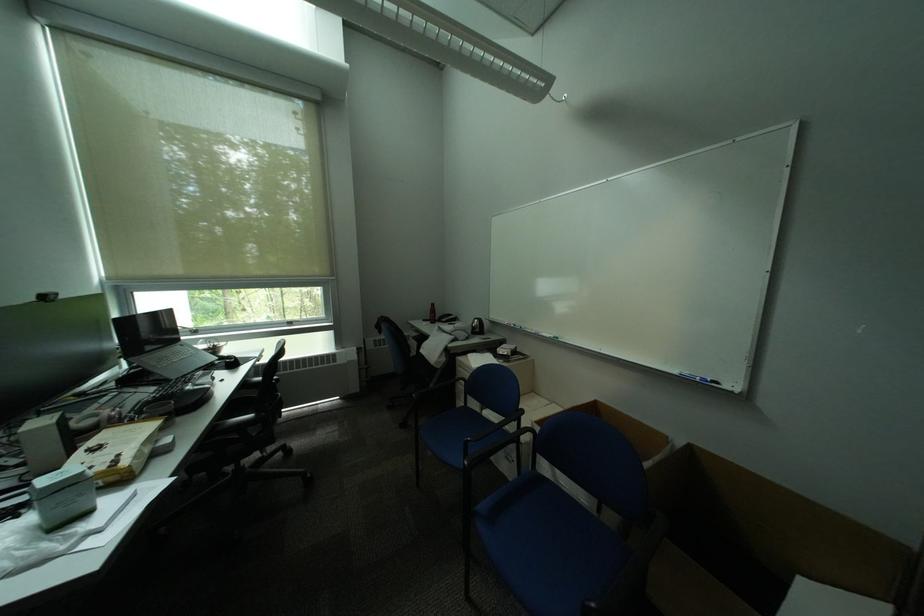
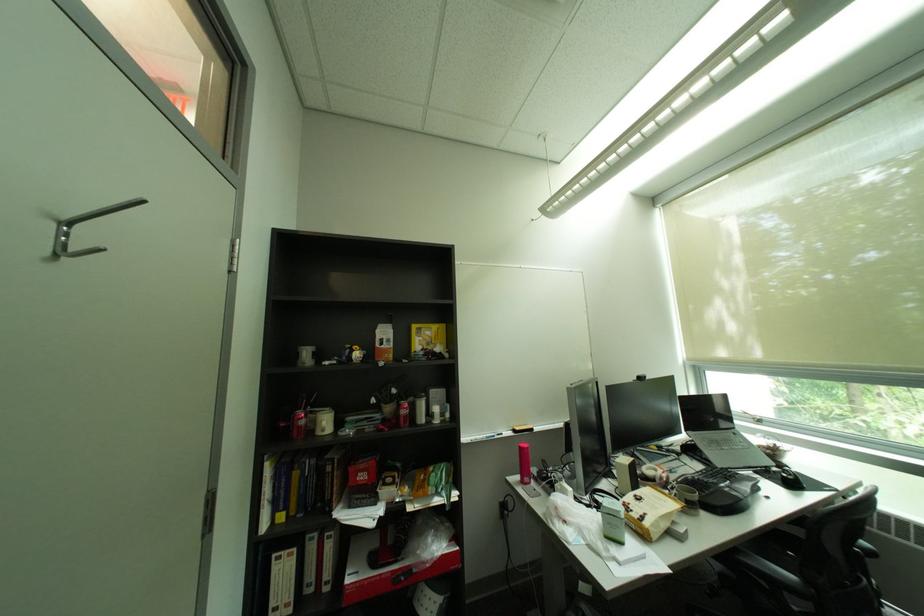
Where in the second image is the point corresponding to the point at 224,363 from the first image?

(777, 468)